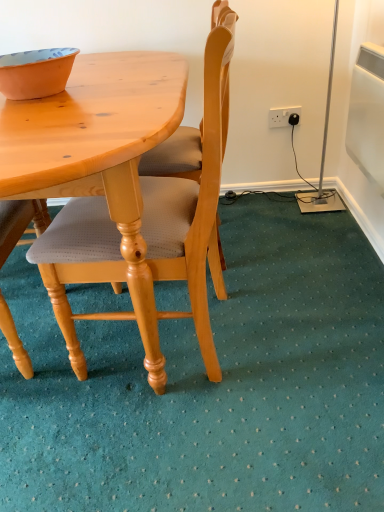
Question: Is point (291, 117) closer or farther from the camera than point (59, 211)?

Choices:
 (A) closer
 (B) farther

Answer: (B)

Question: In terms of size, does white plastic power outlet at upper right appear bigger or smaller than light wood/light brown chair at center?

Choices:
 (A) small
 (B) big

Answer: (A)

Question: Which object is the farthest from the white plastic power outlet at upper right?

Choices:
 (A) light wood/light brown chair at center
 (B) orange matte bowl at upper left

Answer: (B)

Question: Estimate the real-world distances between objects in this image. Which object is farther from the orange matte bowl at upper left?

Choices:
 (A) white plastic power outlet at upper right
 (B) light wood/light brown chair at center

Answer: (A)